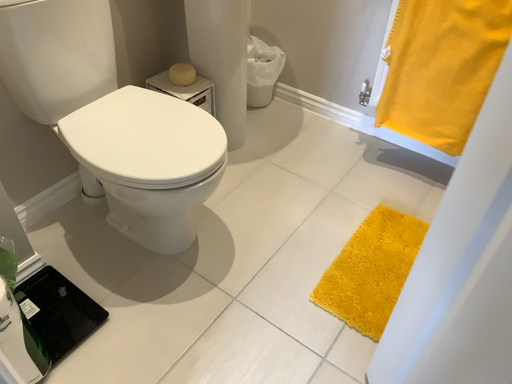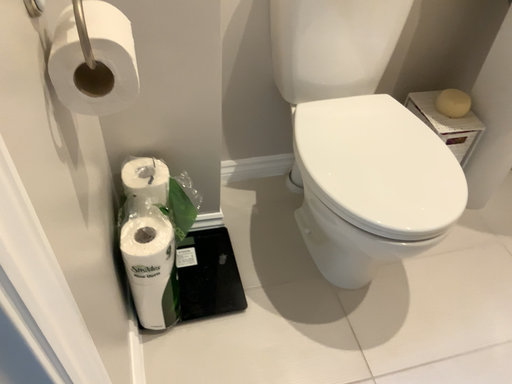
Question: Which way did the camera rotate in the video?

Choices:
 (A) rotated right
 (B) rotated left

Answer: (B)